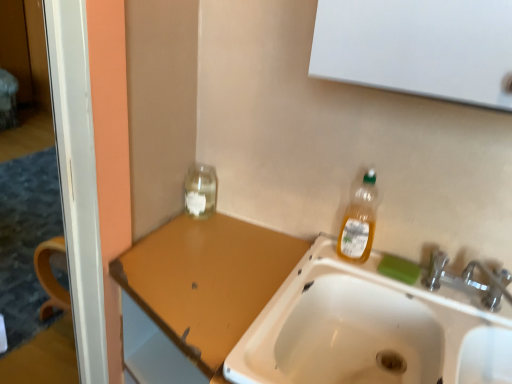
Question: Could you tell me if transparent glass jar at upper left is facing green matte bar of soap at sink right?

Choices:
 (A) yes
 (B) no

Answer: (B)

Question: Is transparent glass jar at upper left turned away from green matte bar of soap at sink right?

Choices:
 (A) yes
 (B) no

Answer: (B)

Question: Is transparent glass jar at upper left thinner than green matte bar of soap at sink right?

Choices:
 (A) no
 (B) yes

Answer: (A)

Question: Considering the relative positions of transparent glass jar at upper left and green matte bar of soap at sink right in the image provided, is transparent glass jar at upper left in front of green matte bar of soap at sink right?

Choices:
 (A) yes
 (B) no

Answer: (B)

Question: From the image's perspective, does transparent glass jar at upper left appear lower than green matte bar of soap at sink right?

Choices:
 (A) no
 (B) yes

Answer: (A)

Question: In the image, is transparent glass jar at upper left on the left side or the right side of translucent plastic bottle at upper right?

Choices:
 (A) right
 (B) left

Answer: (B)

Question: Considering the positions of transparent glass jar at upper left and translucent plastic bottle at upper right in the image, is transparent glass jar at upper left taller or shorter than translucent plastic bottle at upper right?

Choices:
 (A) short
 (B) tall

Answer: (A)

Question: Is transparent glass jar at upper left wider or thinner than translucent plastic bottle at upper right?

Choices:
 (A) thin
 (B) wide

Answer: (B)

Question: Is point (198, 192) closer or farther from the camera than point (369, 236)?

Choices:
 (A) closer
 (B) farther

Answer: (B)

Question: Looking at their shapes, would you say transparent glass jar at upper left is wider or thinner than white ceramic sink at lower center?

Choices:
 (A) wide
 (B) thin

Answer: (B)

Question: Relative to white ceramic sink at lower center, is transparent glass jar at upper left in front or behind?

Choices:
 (A) behind
 (B) front

Answer: (A)

Question: From the image's perspective, relative to white ceramic sink at lower center, is transparent glass jar at upper left above or below?

Choices:
 (A) below
 (B) above

Answer: (B)

Question: From their relative heights in the image, would you say transparent glass jar at upper left is taller or shorter than white ceramic sink at lower center?

Choices:
 (A) tall
 (B) short

Answer: (B)

Question: In terms of height, does green matte bar of soap at sink right look taller or shorter compared to white ceramic sink at lower center?

Choices:
 (A) short
 (B) tall

Answer: (A)

Question: Is green matte bar of soap at sink right situated inside white ceramic sink at lower center or outside?

Choices:
 (A) inside
 (B) outside

Answer: (A)